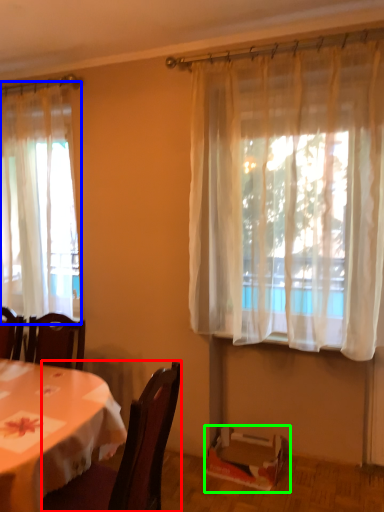
Question: Which object is positioned closest to chair (highlighted by a red box)? Select from curtain (highlighted by a blue box) and box (highlighted by a green box).

Choices:
 (A) curtain
 (B) box

Answer: (B)